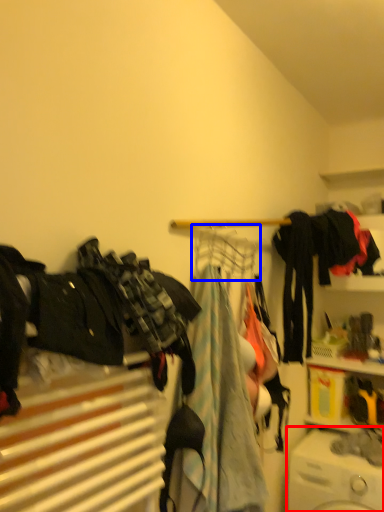
Question: Which object appears closest to the camera in this image, washing machine (highlighted by a red box) or clothesline (highlighted by a blue box)?

Choices:
 (A) washing machine
 (B) clothesline

Answer: (B)